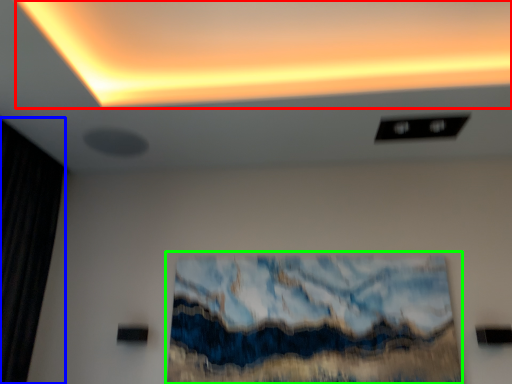
Question: Considering the real-world distances, which object is closest to glow (highlighted by a red box)? curtain (highlighted by a blue box) or oil painting (highlighted by a green box).

Choices:
 (A) curtain
 (B) oil painting

Answer: (B)